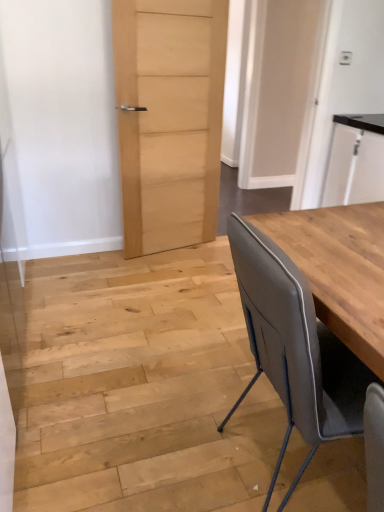
Question: Considering the relative sizes of matte wood door at center, marked as the first door in a right-to-left arrangement, and matte gray chair at right in the image provided, is matte wood door at center, marked as the first door in a right-to-left arrangement, shorter than matte gray chair at right?

Choices:
 (A) no
 (B) yes

Answer: (A)

Question: From the image's perspective, is matte wood door at center, the 2th door positioned from the left, under matte gray chair at right?

Choices:
 (A) no
 (B) yes

Answer: (A)

Question: Does matte wood door at center, the 2th door positioned from the left, have a smaller size compared to matte gray chair at right?

Choices:
 (A) yes
 (B) no

Answer: (A)

Question: Is matte wood door at center, marked as the first door in a right-to-left arrangement, not close to matte gray chair at right?

Choices:
 (A) no
 (B) yes

Answer: (B)

Question: Does matte wood door at center, marked as the first door in a right-to-left arrangement, appear on the right side of matte gray chair at right?

Choices:
 (A) yes
 (B) no

Answer: (A)

Question: Considering the relative positions of matte gray chair at right and matte wood door at center, marked as the first door in a right-to-left arrangement, in the image provided, is matte gray chair at right to the left or to the right of matte wood door at center, marked as the first door in a right-to-left arrangement,?

Choices:
 (A) right
 (B) left

Answer: (B)

Question: Is matte gray chair at right wider or thinner than matte wood door at center, the 2th door positioned from the left?

Choices:
 (A) wide
 (B) thin

Answer: (A)

Question: From the image's perspective, is matte gray chair at right located above or below matte wood door at center, the 2th door positioned from the left?

Choices:
 (A) below
 (B) above

Answer: (A)

Question: From a real-world perspective, relative to matte wood door at center, the 2th door positioned from the left, is matte gray chair at right vertically above or below?

Choices:
 (A) above
 (B) below

Answer: (B)

Question: From a real-world perspective, relative to matte gray chair at right, is matte wood door at center, the 2th door positioned from the left, vertically above or below?

Choices:
 (A) below
 (B) above

Answer: (B)

Question: Choose the correct answer: Is matte wood door at center, the 2th door positioned from the left, inside matte gray chair at right or outside it?

Choices:
 (A) outside
 (B) inside

Answer: (A)

Question: Considering their positions, is matte wood door at center, the 2th door positioned from the left, located in front of or behind matte gray chair at right?

Choices:
 (A) front
 (B) behind

Answer: (B)

Question: Is matte wood door at center, the 2th door positioned from the left, wider or thinner than matte gray chair at right?

Choices:
 (A) thin
 (B) wide

Answer: (A)

Question: Considering the positions of natural wood door at center, which is counted as the second door, starting from the right, and white glossy cabinet at upper right in the image, is natural wood door at center, which is counted as the second door, starting from the right, bigger or smaller than white glossy cabinet at upper right?

Choices:
 (A) big
 (B) small

Answer: (B)

Question: From a real-world perspective, is natural wood door at center, which is counted as the second door, starting from the right, physically located above or below white glossy cabinet at upper right?

Choices:
 (A) above
 (B) below

Answer: (A)